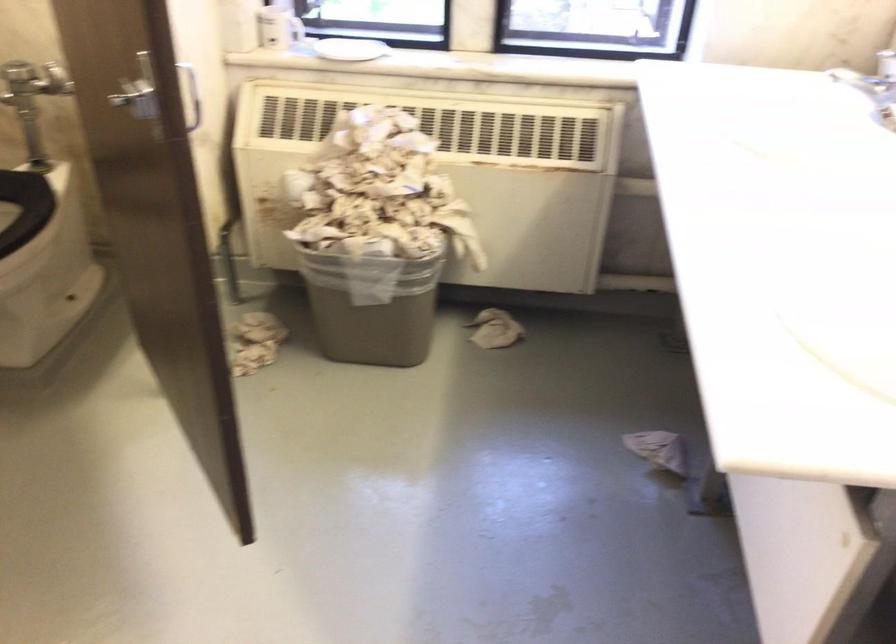
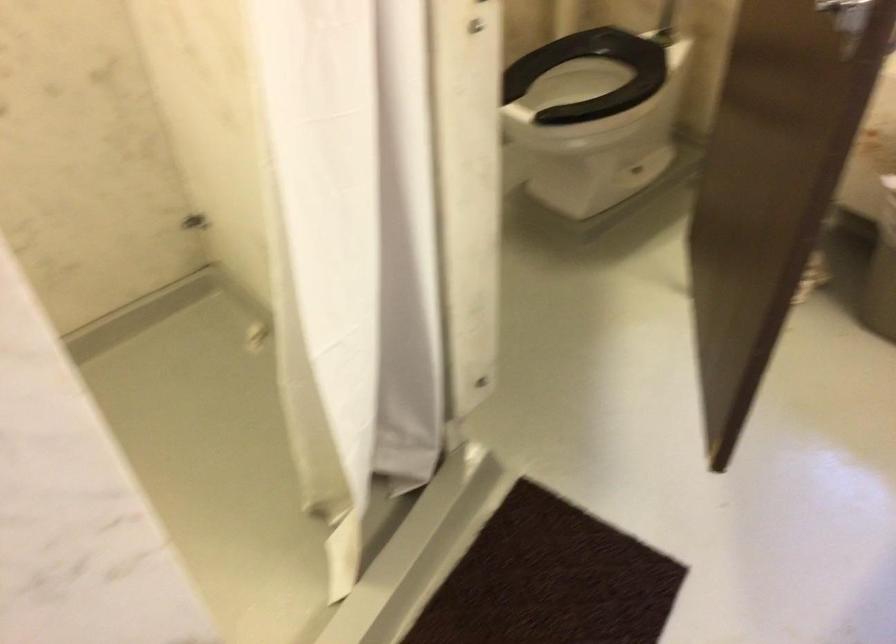
Question: The camera is either moving clockwise (left) or counter-clockwise (right) around the object. The first image is from the beginning of the video and the second image is from the end. Is the camera moving left or right when shooting the video?

Choices:
 (A) Left
 (B) Right

Answer: (B)